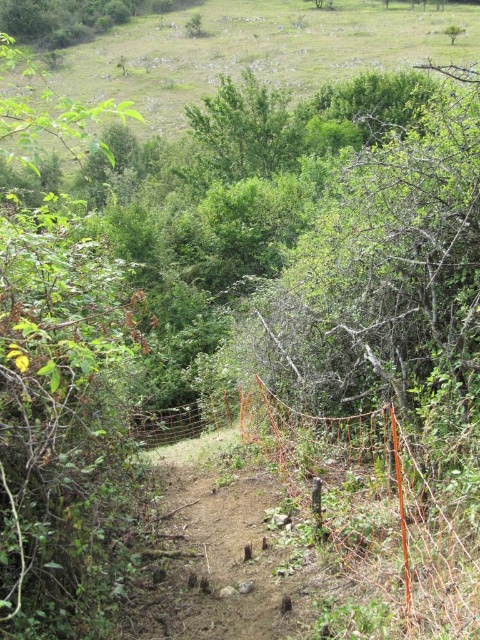
Looking at this image, is orange wire mesh at center above orange mesh fence at center?

Yes, orange wire mesh at center is above orange mesh fence at center.

Does orange wire mesh at center have a lesser width compared to orange mesh fence at center?

Correct, orange wire mesh at center's width is less than orange mesh fence at center's.

Describe the element at coordinates (381, 509) in the screenshot. The height and width of the screenshot is (640, 480). I see `orange wire mesh at center` at that location.

You are a GUI agent. You are given a task and a screenshot of the screen. Output one action in this format:
    pyautogui.click(x=<x>, y=<y>)
    Task: Click on the orange wire mesh at center
    
    Given the screenshot: What is the action you would take?
    pyautogui.click(x=381, y=509)